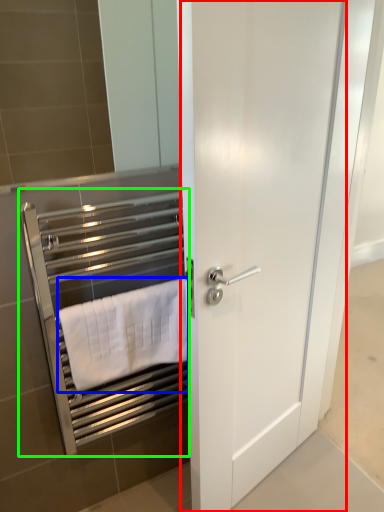
Question: Which is nearer to the door (highlighted by a red box)? towel (highlighted by a blue box) or closet (highlighted by a green box).

Choices:
 (A) towel
 (B) closet

Answer: (A)